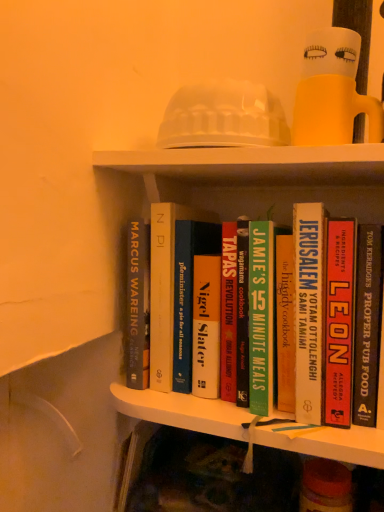
Question: From a real-world perspective, does translucent plastic doll at upper center sit lower than green matte book at center, acting as the fourth book starting from the right?

Choices:
 (A) no
 (B) yes

Answer: (A)

Question: Can green matte book at center, acting as the fourth book starting from the right, be found inside translucent plastic doll at upper center?

Choices:
 (A) no
 (B) yes

Answer: (A)

Question: Is translucent plastic doll at upper center behind green matte book at center, acting as the fourth book starting from the right?

Choices:
 (A) no
 (B) yes

Answer: (A)

Question: From the image's perspective, is translucent plastic doll at upper center on top of green matte book at center, the second book positioned from the left?

Choices:
 (A) yes
 (B) no

Answer: (A)

Question: Is the position of translucent plastic doll at upper center less distant than that of green matte book at center, acting as the fourth book starting from the right?

Choices:
 (A) yes
 (B) no

Answer: (A)

Question: In the image, is hardcover book at center, which ranks as the 2th book in right-to-left order, positioned in front of or behind green matte book at center, the second book positioned from the left?

Choices:
 (A) front
 (B) behind

Answer: (A)

Question: Based on their positions, is hardcover book at center, placed as the fourth book when sorted from left to right, located to the left or right of green matte book at center, the second book positioned from the left?

Choices:
 (A) right
 (B) left

Answer: (A)

Question: Looking at their shapes, would you say hardcover book at center, which ranks as the 2th book in right-to-left order, is wider or thinner than green matte book at center, acting as the fourth book starting from the right?

Choices:
 (A) thin
 (B) wide

Answer: (B)

Question: In terms of height, does hardcover book at center, which ranks as the 2th book in right-to-left order, look taller or shorter compared to green matte book at center, acting as the fourth book starting from the right?

Choices:
 (A) tall
 (B) short

Answer: (A)

Question: Is translucent plastic doll at upper center inside or outside of hardcover cookbook at center, arranged as the 3th book when viewed from the right?

Choices:
 (A) outside
 (B) inside

Answer: (A)

Question: Looking at the image, does translucent plastic doll at upper center seem bigger or smaller compared to hardcover cookbook at center, arranged as the 3th book when viewed from the right?

Choices:
 (A) big
 (B) small

Answer: (B)

Question: From the image's perspective, is translucent plastic doll at upper center positioned above or below hardcover cookbook at center, arranged as the 3th book when viewed from the right?

Choices:
 (A) above
 (B) below

Answer: (A)

Question: Is point (319, 60) positioned closer to the camera than point (302, 307)?

Choices:
 (A) farther
 (B) closer

Answer: (A)

Question: In terms of width, does hardcover cookbook at center, arranged as the 3th book when viewed from the right, look wider or thinner when compared to hardcover book at center, the first book when ordered from left to right?

Choices:
 (A) thin
 (B) wide

Answer: (B)

Question: Considering their positions, is hardcover cookbook at center, arranged as the 3th book when viewed from the right, located in front of or behind hardcover book at center, the first book when ordered from left to right?

Choices:
 (A) behind
 (B) front

Answer: (B)